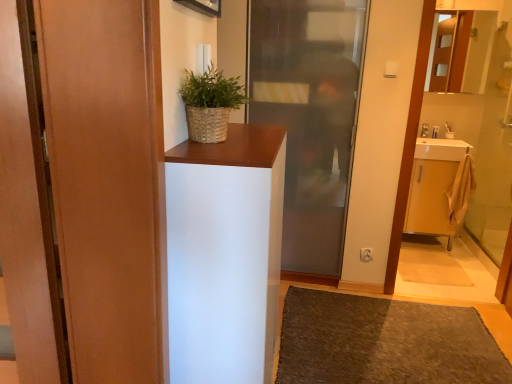
You are a GUI agent. You are given a task and a screenshot of the screen. Output one action in this format:
    pyautogui.click(x=<x>, y=<y>)
    Task: Click on the free spot below woven brown basket at upper center (from a real-world perspective)
    The height and width of the screenshot is (384, 512).
    Given the screenshot: What is the action you would take?
    pyautogui.click(x=214, y=141)